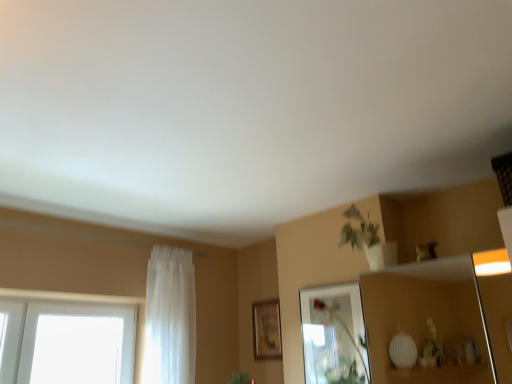
Question: Can you confirm if white sheer curtain at left is positioned to the right of wooden picture frame at center?

Choices:
 (A) no
 (B) yes

Answer: (A)

Question: From a real-world perspective, is white sheer curtain at left below wooden picture frame at center?

Choices:
 (A) no
 (B) yes

Answer: (A)

Question: From a real-world perspective, is white sheer curtain at left on wooden picture frame at center?

Choices:
 (A) no
 (B) yes

Answer: (B)

Question: Is white sheer curtain at left positioned beyond the bounds of wooden picture frame at center?

Choices:
 (A) no
 (B) yes

Answer: (B)

Question: Is white sheer curtain at left positioned far away from wooden picture frame at center?

Choices:
 (A) no
 (B) yes

Answer: (A)

Question: From the image's perspective, is wooden picture frame at center located above or below clear glass mirror at upper center?

Choices:
 (A) above
 (B) below

Answer: (B)

Question: Considering the positions of point (275, 350) and point (333, 380), is point (275, 350) closer or farther from the camera than point (333, 380)?

Choices:
 (A) closer
 (B) farther

Answer: (B)

Question: Based on their sizes in the image, would you say wooden picture frame at center is bigger or smaller than clear glass mirror at upper center?

Choices:
 (A) small
 (B) big

Answer: (A)

Question: From a real-world perspective, relative to clear glass mirror at upper center, is wooden picture frame at center vertically above or below?

Choices:
 (A) above
 (B) below

Answer: (A)

Question: From a real-world perspective, is clear glass mirror at upper center above or below wooden picture frame at center?

Choices:
 (A) below
 (B) above

Answer: (A)

Question: From their relative heights in the image, would you say clear glass mirror at upper center is taller or shorter than wooden picture frame at center?

Choices:
 (A) short
 (B) tall

Answer: (B)

Question: Considering their positions, is clear glass mirror at upper center located in front of or behind wooden picture frame at center?

Choices:
 (A) front
 (B) behind

Answer: (A)

Question: Considering the positions of clear glass mirror at upper center and wooden picture frame at center in the image, is clear glass mirror at upper center bigger or smaller than wooden picture frame at center?

Choices:
 (A) small
 (B) big

Answer: (B)

Question: Choose the correct answer: Is white sheer curtain at left inside wooden picture frame at center or outside it?

Choices:
 (A) outside
 (B) inside

Answer: (A)

Question: Does point (152, 284) appear closer or farther from the camera than point (265, 357)?

Choices:
 (A) closer
 (B) farther

Answer: (A)